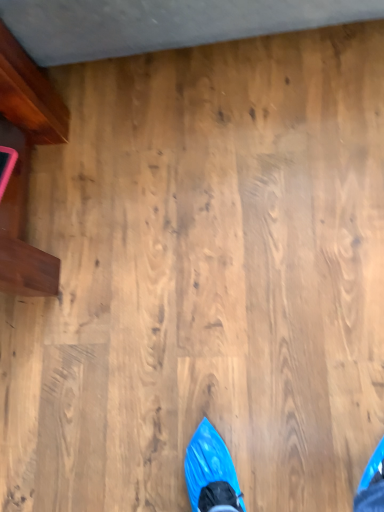
Find the location of `wooden desk at left`. wooden desk at left is located at coordinates (25, 165).

What do you see at coordinates (25, 165) in the screenshot? I see `wooden desk at left` at bounding box center [25, 165].

Where is `wooden desk at left`? The height and width of the screenshot is (512, 384). wooden desk at left is located at coordinates (25, 165).